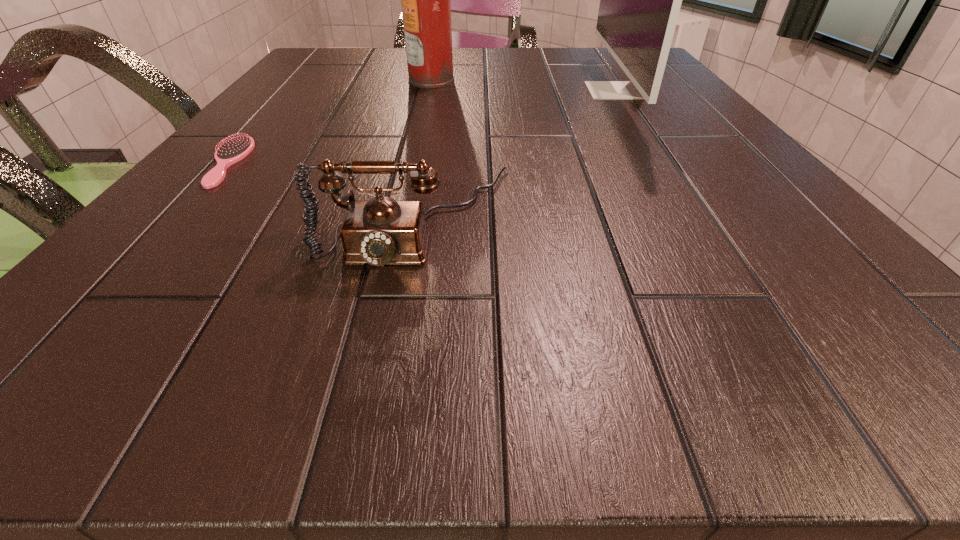
The width and height of the screenshot is (960, 540). What are the coordinates of `vacant space located on the dial of the telephone` in the screenshot? It's located at (389, 357).

At what (x,y) coordinates should I click in order to perform the action: click on free spot located on the front of the leftmost object. Please return your answer as a coordinate pair (x, y). This screenshot has height=540, width=960. Looking at the image, I should click on (135, 263).

I want to click on fire extinguisher that is positioned at the far edge, so click(426, 0).

You are a GUI agent. You are given a task and a screenshot of the screen. Output one action in this format:
    pyautogui.click(x=<x>, y=<y>)
    Task: Click on the monitor present at the far edge
    
    Given the screenshot: What is the action you would take?
    pyautogui.click(x=640, y=0)

Identify the location of object that is at the left edge. (232, 150).

The image size is (960, 540). I want to click on object that is at the right edge, so point(640,0).

Image resolution: width=960 pixels, height=540 pixels. I want to click on object located in the far right corner section of the desktop, so coord(640,0).

Find the location of a particular element. Image resolution: width=960 pixels, height=540 pixels. vacant space at the far edge of the desktop is located at coordinates (398, 59).

Image resolution: width=960 pixels, height=540 pixels. Find the location of `blank space at the left edge`. blank space at the left edge is located at coordinates (321, 127).

Find the location of `free space at the right edge`. free space at the right edge is located at coordinates (688, 147).